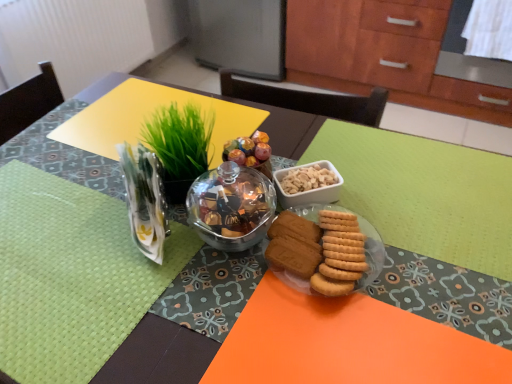
Question: Looking at the image, does golden matte cookies at center seem bigger or smaller compared to clear plastic vase at upper left?

Choices:
 (A) small
 (B) big

Answer: (A)

Question: In the image, is golden matte cookies at center positioned in front of or behind clear plastic vase at upper left?

Choices:
 (A) front
 (B) behind

Answer: (B)

Question: Which object is positioned farthest from the clear plastic vase at upper left?

Choices:
 (A) green woven placemat at left
 (B) matte glass bowl at center
 (C) golden matte cookies at center
 (D) matte glass plate at center
 (E) green leafy grass at upper center

Answer: (D)

Question: Which object is the closest to the green woven placemat at left?

Choices:
 (A) matte glass bowl at center
 (B) matte glass plate at center
 (C) clear plastic vase at upper left
 (D) golden matte cookies at center
 (E) green leafy grass at upper center

Answer: (C)